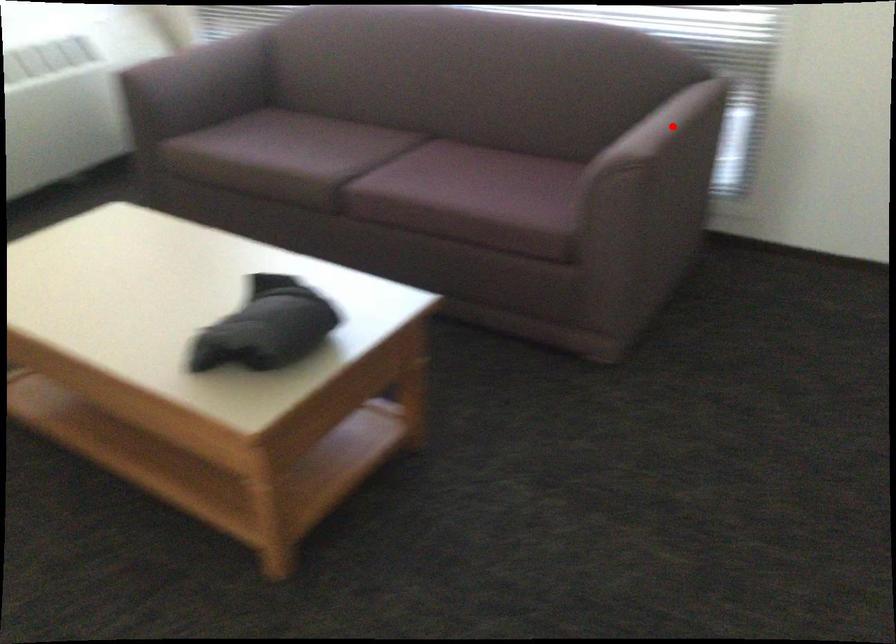
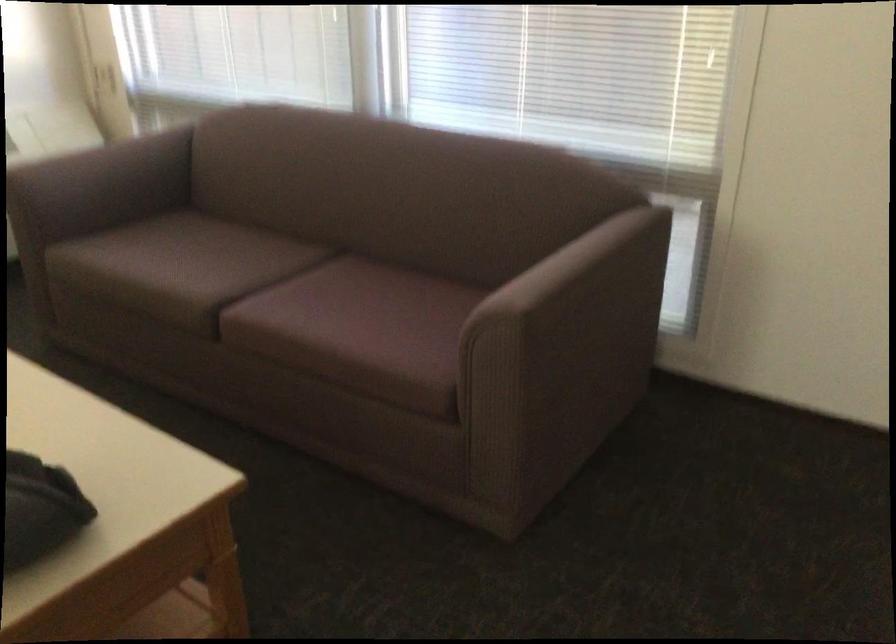
Question: I am providing you with two images of the same scene from different viewpoints. Given a red point in image1, look at the same physical point in image2. Is it:

Choices:
 (A) Closer to the viewpoint
 (B) Farther from the viewpoint

Answer: (A)